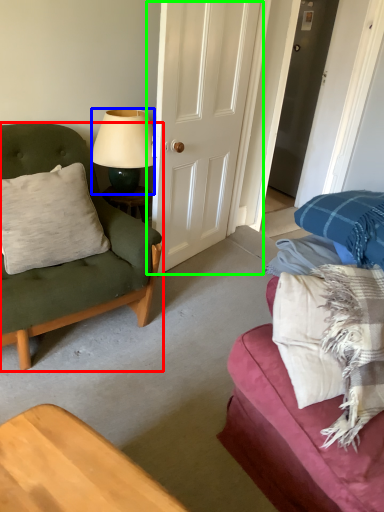
Question: Considering the real-world distances, which object is farthest from chair (highlighted by a red box)? lamp (highlighted by a blue box) or door (highlighted by a green box)?

Choices:
 (A) lamp
 (B) door

Answer: (B)